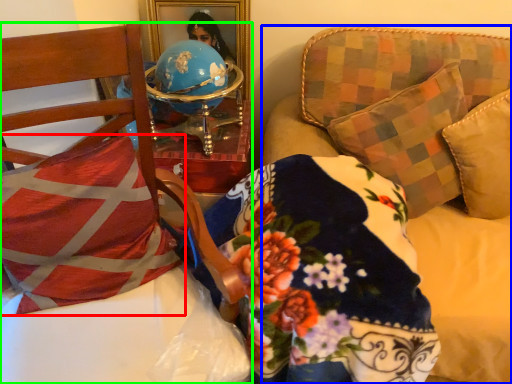
Question: Estimate the real-world distances between objects in this image. Which object is farther from pillow (highlighted by a red box), studio couch (highlighted by a blue box) or furniture (highlighted by a green box)?

Choices:
 (A) studio couch
 (B) furniture

Answer: (A)